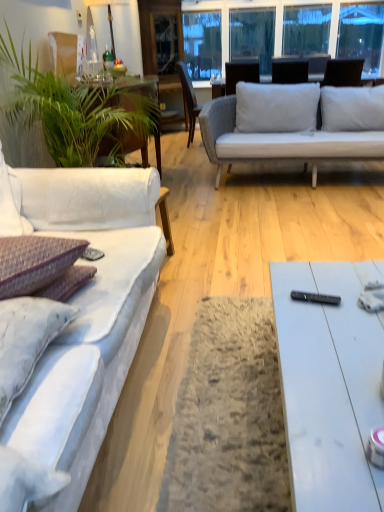
Find the location of a particular element. The width and height of the screenshot is (384, 512). free space in front of black plastic remote control at center is located at coordinates (327, 332).